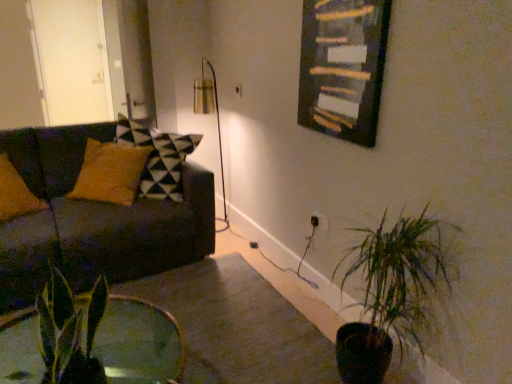
Question: Considering the relative positions of metallic gold table lamp at center and green glossy leaf at lower left, positioned as the 2th houseplant in right-to-left order, in the image provided, is metallic gold table lamp at center in front of green glossy leaf at lower left, positioned as the 2th houseplant in right-to-left order,?

Choices:
 (A) yes
 (B) no

Answer: (B)

Question: Does metallic gold table lamp at center have a larger size compared to green glossy leaf at lower left, the 1th houseplant positioned from the left?

Choices:
 (A) no
 (B) yes

Answer: (B)

Question: Does metallic gold table lamp at center have a smaller size compared to green glossy leaf at lower left, marked as the 1th houseplant in a front-to-back arrangement?

Choices:
 (A) no
 (B) yes

Answer: (A)

Question: Can you confirm if metallic gold table lamp at center is taller than green glossy leaf at lower left, positioned as the 2th houseplant in right-to-left order?

Choices:
 (A) no
 (B) yes

Answer: (B)

Question: Does metallic gold table lamp at center appear on the right side of green glossy leaf at lower left, marked as the 1th houseplant in a front-to-back arrangement?

Choices:
 (A) no
 (B) yes

Answer: (B)

Question: Are metallic gold table lamp at center and green glossy leaf at lower left, marked as the 1th houseplant in a front-to-back arrangement, located far from each other?

Choices:
 (A) no
 (B) yes

Answer: (B)

Question: Considering the relative sizes of green leafy plant at lower right, arranged as the 2th houseplant when viewed from the front, and white glossy door at upper left in the image provided, is green leafy plant at lower right, arranged as the 2th houseplant when viewed from the front, smaller than white glossy door at upper left?

Choices:
 (A) no
 (B) yes

Answer: (B)

Question: Does green leafy plant at lower right, arranged as the 1th houseplant when viewed from the right, touch white glossy door at upper left?

Choices:
 (A) yes
 (B) no

Answer: (B)

Question: Is green leafy plant at lower right, arranged as the 2th houseplant when viewed from the front, to the left of white glossy door at upper left from the viewer's perspective?

Choices:
 (A) no
 (B) yes

Answer: (A)

Question: Is green leafy plant at lower right, arranged as the 1th houseplant when viewed from the right, not near white glossy door at upper left?

Choices:
 (A) yes
 (B) no

Answer: (A)

Question: From a real-world perspective, is green leafy plant at lower right, placed as the 2th houseplant when sorted from left to right, physically below white glossy door at upper left?

Choices:
 (A) yes
 (B) no

Answer: (A)

Question: Does green leafy plant at lower right, arranged as the 2th houseplant when viewed from the front, have a greater height compared to white glossy door at upper left?

Choices:
 (A) no
 (B) yes

Answer: (A)

Question: Is green leafy plant at lower right, the 1th houseplant positioned from the back, next to wooden frame at upper center and touching it?

Choices:
 (A) yes
 (B) no

Answer: (B)